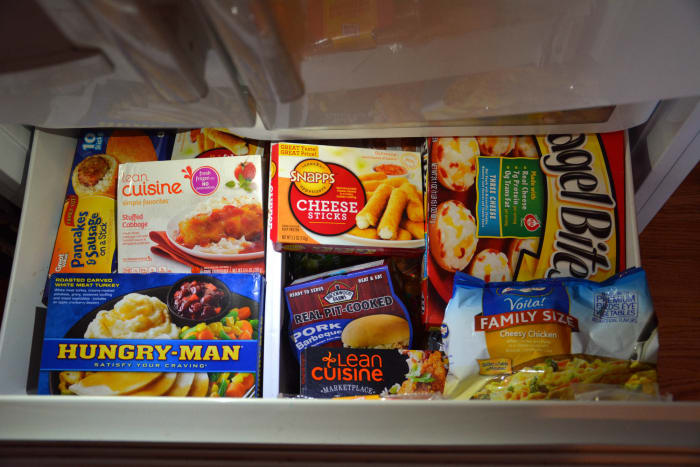
Identify the location of refrigerator door. (374, 90).